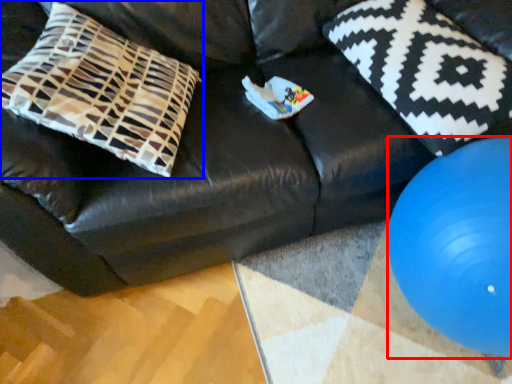
Question: Which object is further to the camera taking this photo, ball (highlighted by a red box) or pillow (highlighted by a blue box)?

Choices:
 (A) ball
 (B) pillow

Answer: (B)